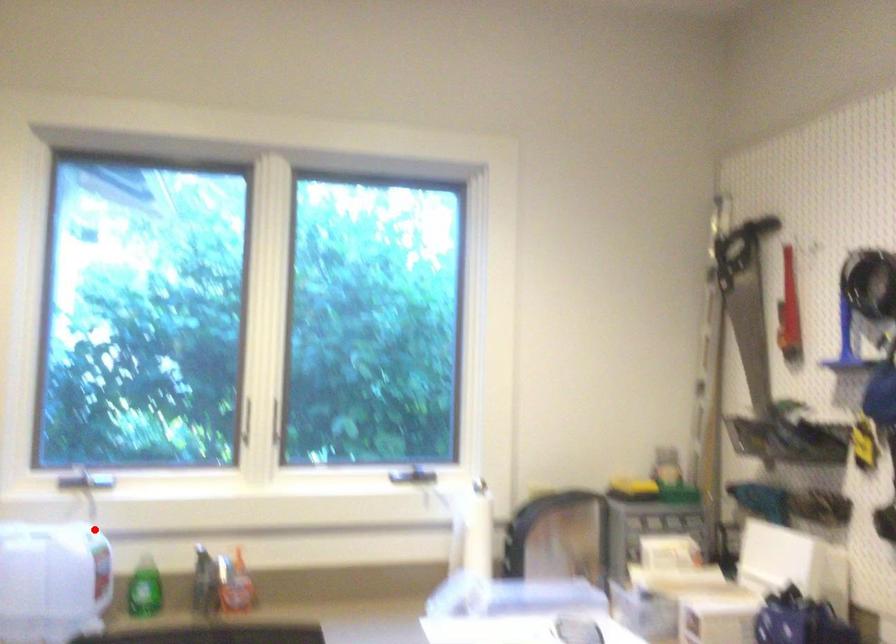
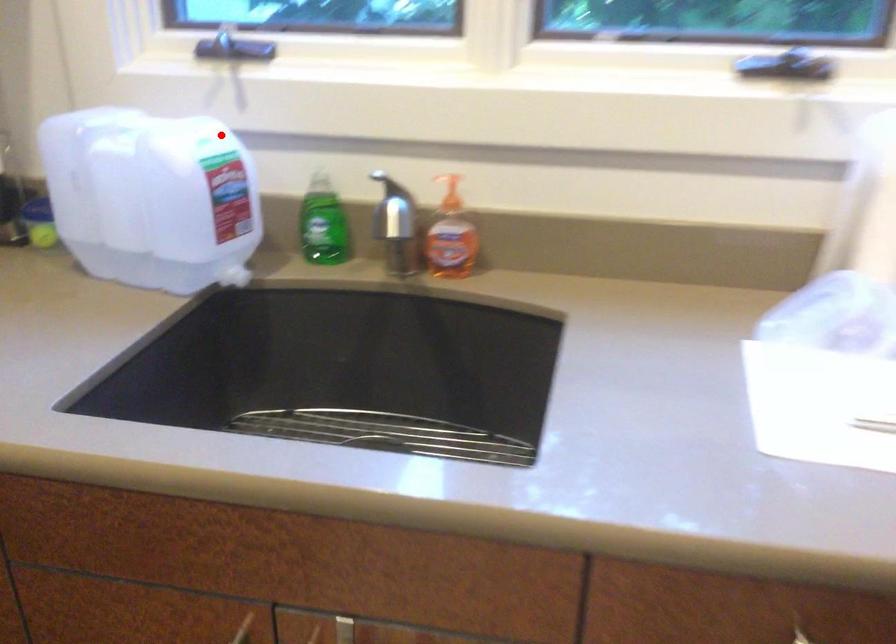
I am providing you with two images of the same scene from different viewpoints. A red point is marked on the first image and another point is marked on the second image. Do the highlighted points in image1 and image2 indicate the same real-world spot?

Yes